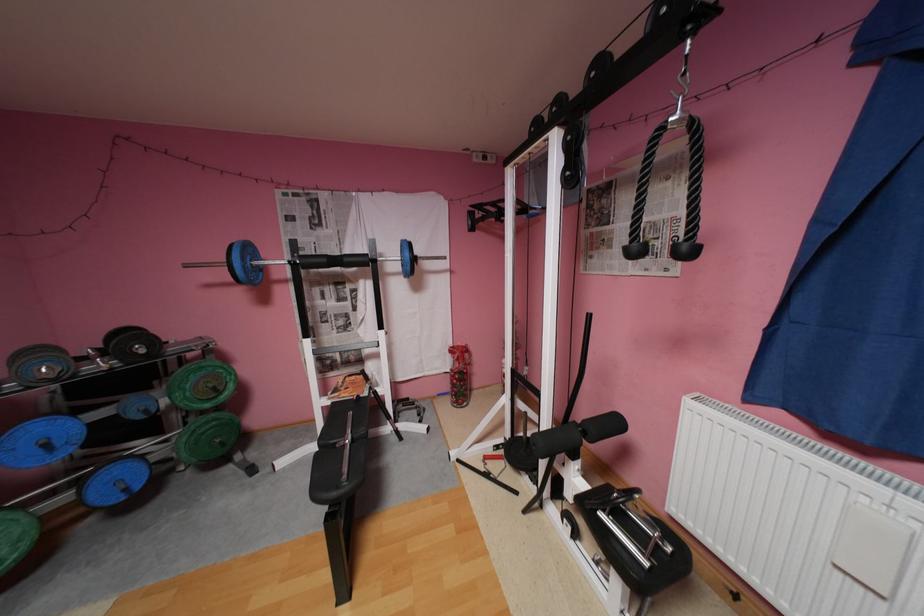
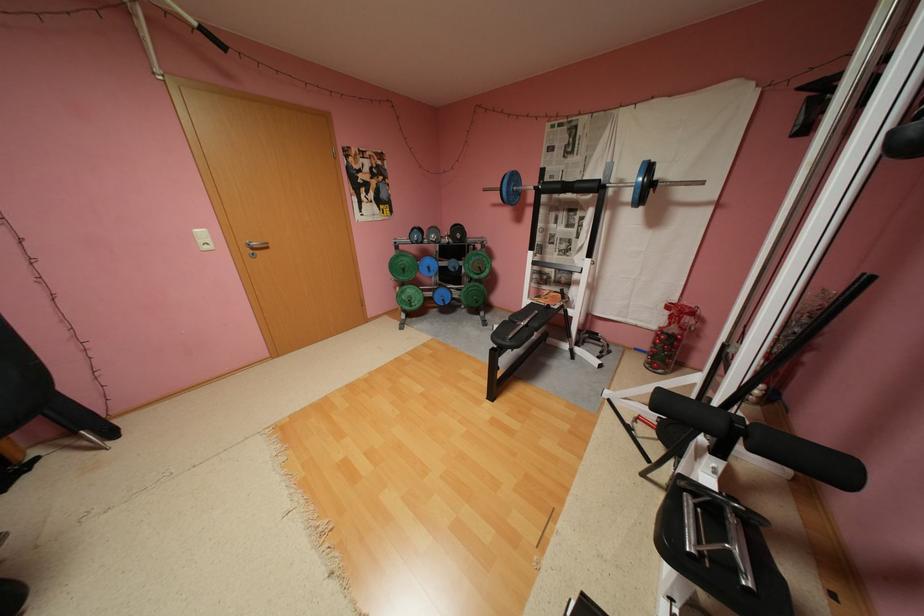
Find the pixel in the second image that matches point (224, 387) in the first image.

(489, 267)